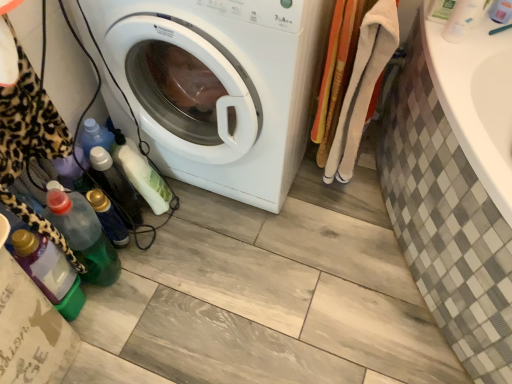
Where is `free area in between white glossy washing machine at center and translucent plastic bottle at lower left, which ranks as the fifth bottle in left-to-right order`? The image size is (512, 384). free area in between white glossy washing machine at center and translucent plastic bottle at lower left, which ranks as the fifth bottle in left-to-right order is located at coordinates (204, 224).